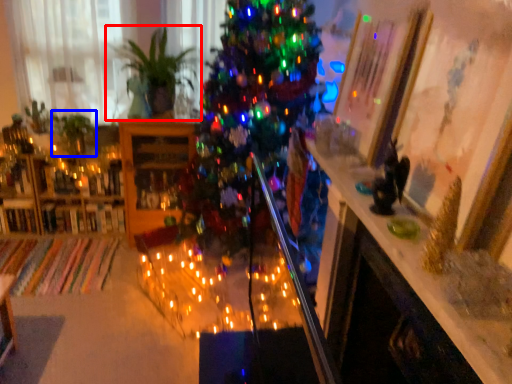
Question: Which point is further to the camera, houseplant (highlighted by a red box) or plant (highlighted by a blue box)?

Choices:
 (A) houseplant
 (B) plant

Answer: (B)